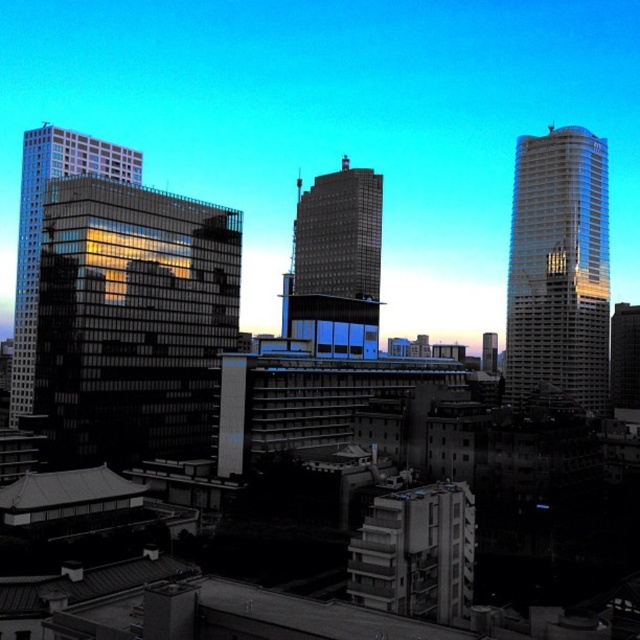
You are a drone operator trying to fly a drone between the shiny glass skyscraper at right and the reflective glass building at left. The drone has a maximum flight distance of 120 meters. Can the drone safely fly between them without exceeding its range?

The shiny glass skyscraper at right is 122.87 meters from the reflective glass building at left. Since the drone has a maximum flight distance of 120 meters, it cannot safely fly between them without exceeding its range.

You are standing in the city and want to take a photo of both the shiny glass skyscraper at right and the reflective glass building at left. Which building should you move closer to in order to include both in your camera frame?

You should move closer to the shiny glass skyscraper at right because it is closer to you than the reflective glass building at left, allowing both to be captured in the frame by adjusting your position accordingly.